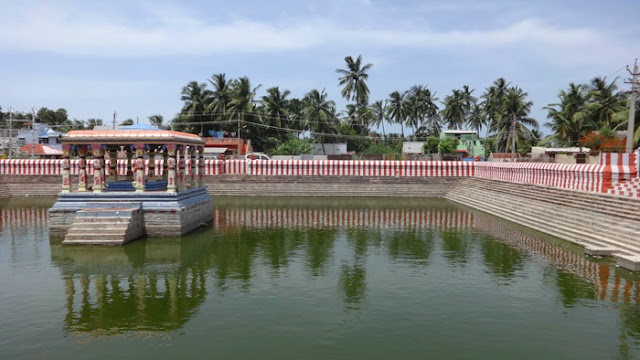
Find the location of a particular element. This screenshot has height=360, width=640. pillar is located at coordinates (172, 183).